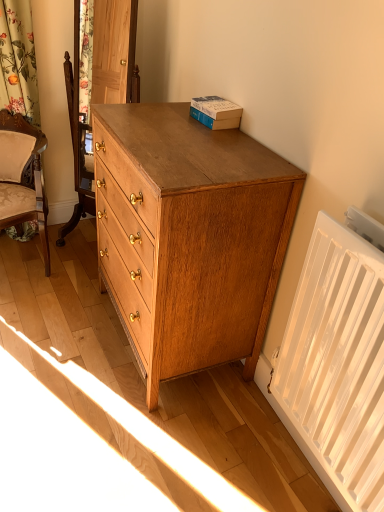
This screenshot has height=512, width=384. Identify the location of vacant space in front of beige upholstered chair at left. (38, 318).